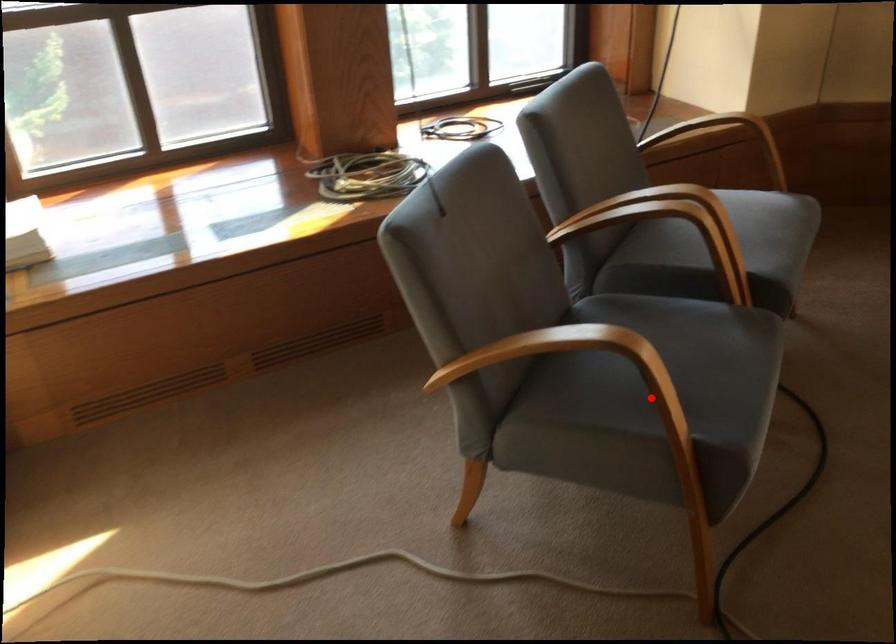
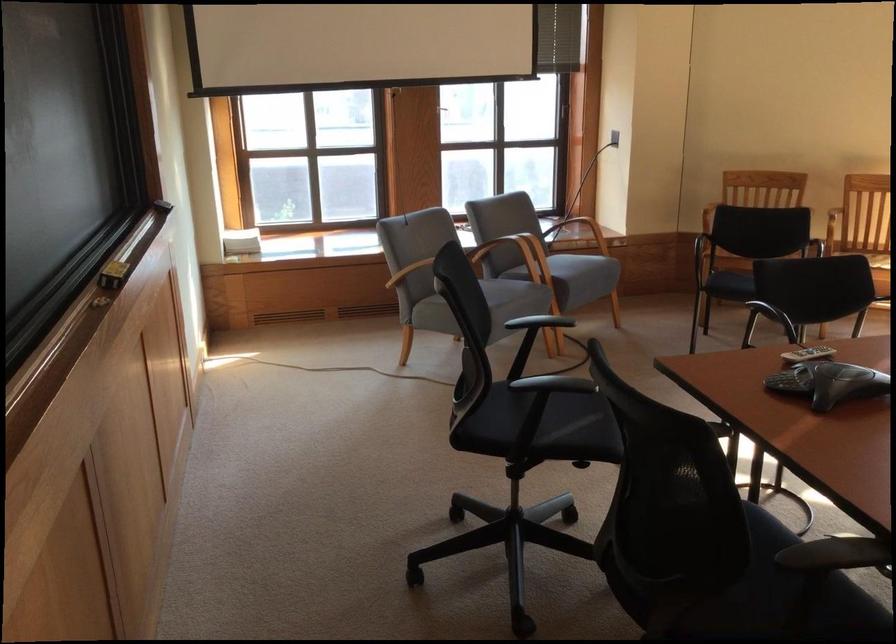
Question: I am providing you with two images of the same scene from different viewpoints. A red point is marked on the first image. Is the red point's position out of view in image 2?

Choices:
 (A) Yes
 (B) No

Answer: (A)